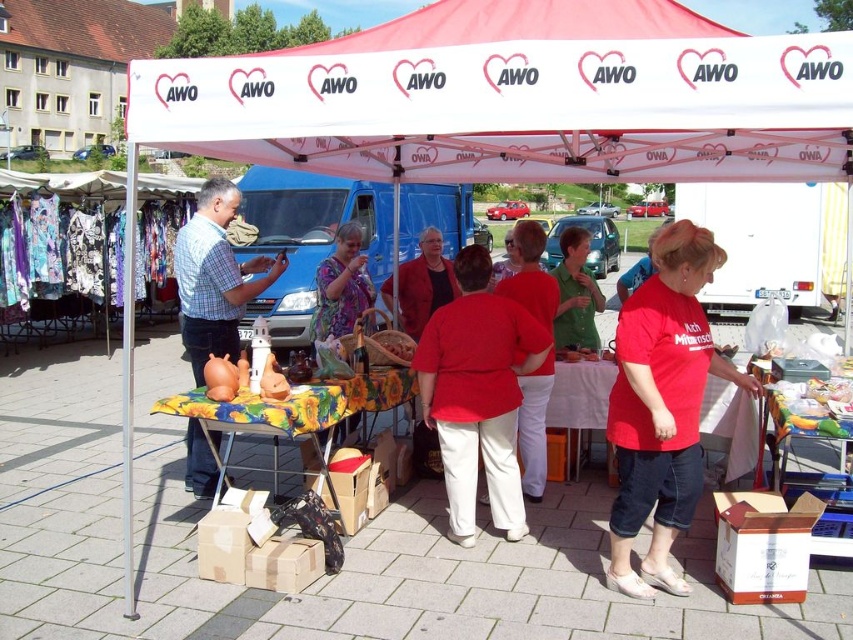
Question: Can you confirm if matte brown clay pot at left is smaller than matte purple blouse at center?

Choices:
 (A) no
 (B) yes

Answer: (B)

Question: Estimate the real-world distances between objects in this image. Which object is farther from the matte purple blouse at center?

Choices:
 (A) matte red shirt at center
 (B) red matte shirt at center
 (C) matte red coat at center

Answer: (B)

Question: Does red matte shirt at center appear under matte red coat at center?

Choices:
 (A) no
 (B) yes

Answer: (B)

Question: Is matte brown clay pot at left to the left of green matte shirt at center from the viewer's perspective?

Choices:
 (A) no
 (B) yes

Answer: (B)

Question: Among these points, which one is farthest from the camera?

Choices:
 (A) 570,284
 (B) 349,298
 (C) 196,224

Answer: (A)

Question: Which of the following is the closest to the observer?

Choices:
 (A) (764, 145)
 (B) (363, 298)
 (C) (233, 257)
 (D) (543, 369)

Answer: (D)